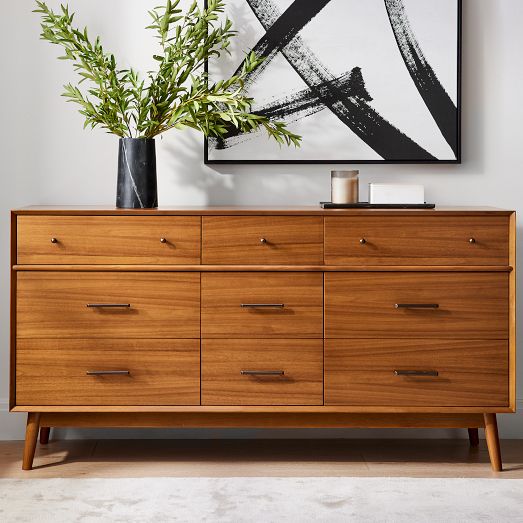
Locate an element on the screen. The width and height of the screenshot is (523, 523). vase is located at coordinates (139, 168).